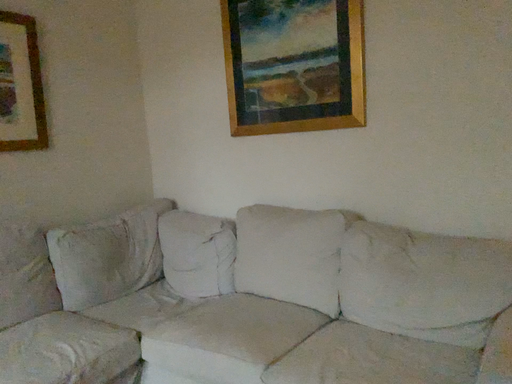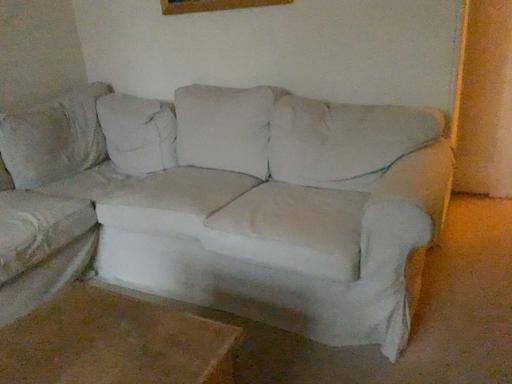
Question: Which way did the camera rotate in the video?

Choices:
 (A) rotated upward
 (B) rotated downward

Answer: (B)